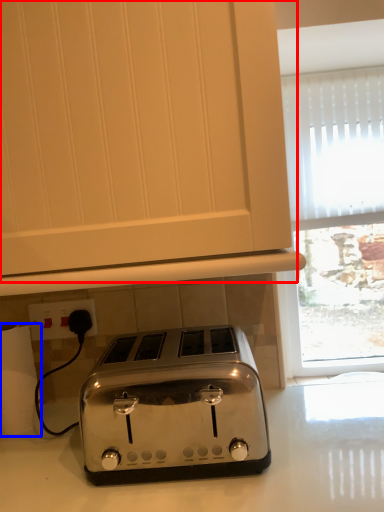
Question: Which of the following is the farthest to the observer, oven (highlighted by a red box) or toilet paper (highlighted by a blue box)?

Choices:
 (A) oven
 (B) toilet paper

Answer: (B)